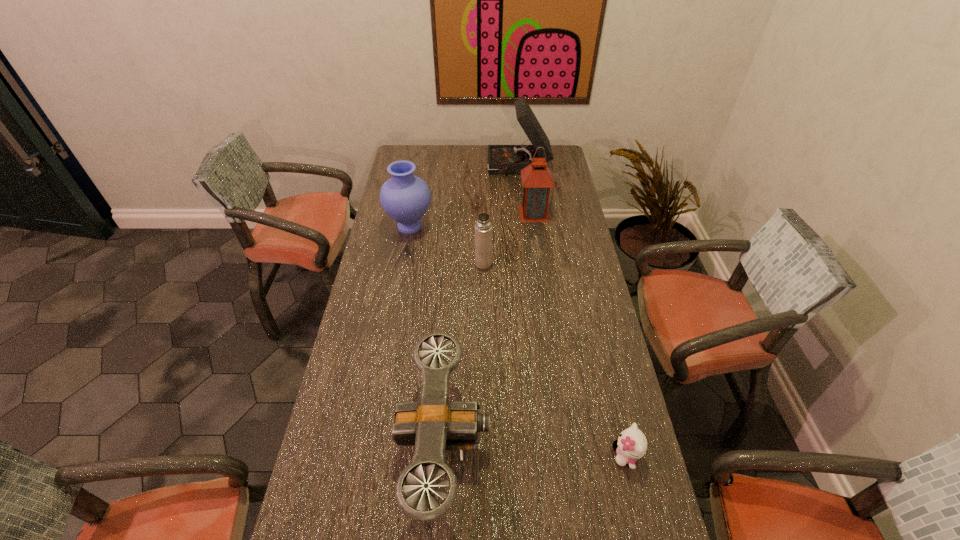
This screenshot has width=960, height=540. In order to click on blank area located on the front-facing side of the farthest object in this screenshot , I will do `click(478, 167)`.

At what (x,y) coordinates should I click in order to perform the action: click on vacant region located on the right of the vase. Please return your answer as a coordinate pair (x, y). Looking at the image, I should click on (517, 227).

The height and width of the screenshot is (540, 960). I want to click on free space located 0.140m on the right of the thermos bottle, so click(x=528, y=264).

Image resolution: width=960 pixels, height=540 pixels. Identify the location of vacant space located 0.090m on the front-facing side of the kitten. (578, 455).

Image resolution: width=960 pixels, height=540 pixels. What are the coordinates of `vacant space positioned 0.280m on the front-facing side of the kitten` in the screenshot? It's located at (506, 455).

You are a GUI agent. You are given a task and a screenshot of the screen. Output one action in this format:
    pyautogui.click(x=<x>, y=<y>)
    Task: Click on the vacant space located 0.240m on the front-facing side of the kitten
    Image resolution: width=960 pixels, height=540 pixels.
    Given the screenshot: What is the action you would take?
    pyautogui.click(x=521, y=455)

You are a GUI agent. You are given a task and a screenshot of the screen. Output one action in this format:
    pyautogui.click(x=<x>, y=<y>)
    Task: Click on the object present at the far edge
    Image resolution: width=960 pixels, height=540 pixels.
    Given the screenshot: What is the action you would take?
    pyautogui.click(x=502, y=159)

Locate an element on the screen. object at the left edge is located at coordinates [405, 198].

The height and width of the screenshot is (540, 960). In order to click on lantern located in the right edge section of the desktop in this screenshot , I will do `click(537, 179)`.

Where is `phonograph_record present at the right edge`? phonograph_record present at the right edge is located at coordinates (502, 159).